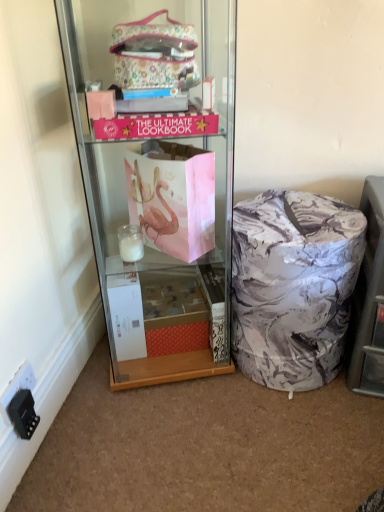
What do you see at coordinates (18, 384) in the screenshot?
I see `black plastic power outlet at lower left` at bounding box center [18, 384].

Describe the element at coordinates (293, 286) in the screenshot. I see `marble-patterned laundry basket at lower right` at that location.

This screenshot has height=512, width=384. What do you see at coordinates (159, 178) in the screenshot?
I see `matte pink paper bag at center` at bounding box center [159, 178].

Find the location of a particular element. The width and height of the screenshot is (384, 512). black plastic power outlet at lower left is located at coordinates (18, 384).

Does point (26, 380) lie in front of point (353, 336)?

Yes, point (26, 380) is closer to viewer.

Is black plastic power outlet at lower left positioned with its back to marble-patterned ottoman at lower right?

black plastic power outlet at lower left is not turned away from marble-patterned ottoman at lower right.

Is black plastic power outlet at lower left to the left or to the right of marble-patterned ottoman at lower right in the image?

black plastic power outlet at lower left is positioned on marble-patterned ottoman at lower right's left side.

Who is bigger, black plastic power outlet at lower left or marble-patterned ottoman at lower right?

marble-patterned ottoman at lower right.

Considering the relative sizes of marble-patterned laundry basket at lower right and marble-patterned ottoman at lower right in the image provided, is marble-patterned laundry basket at lower right bigger than marble-patterned ottoman at lower right?

Yes.

Is marble-patterned laundry basket at lower right touching marble-patterned ottoman at lower right?

No.

Is marble-patterned laundry basket at lower right outside of marble-patterned ottoman at lower right?

Yes, marble-patterned laundry basket at lower right is located beyond the bounds of marble-patterned ottoman at lower right.

Which object is wider, marble-patterned laundry basket at lower right or marble-patterned ottoman at lower right?

Wider between the two is marble-patterned ottoman at lower right.

In the scene shown: In terms of height, does black plastic power outlet at lower left look taller or shorter compared to marble-patterned laundry basket at lower right?

Considering their sizes, black plastic power outlet at lower left has less height than marble-patterned laundry basket at lower right.

Considering the relative sizes of black plastic power outlet at lower left and marble-patterned laundry basket at lower right in the image provided, is black plastic power outlet at lower left bigger than marble-patterned laundry basket at lower right?

No.

From the image's perspective, which object appears higher, black plastic power outlet at lower left or marble-patterned laundry basket at lower right?

marble-patterned laundry basket at lower right appears higher in the image.

Between black plastic power outlet at lower left and marble-patterned laundry basket at lower right, which one is positioned behind?

Positioned behind is marble-patterned laundry basket at lower right.

Relative to marble-patterned laundry basket at lower right, is marble-patterned ottoman at lower right in front or behind?

marble-patterned ottoman at lower right is positioned closer to the viewer than marble-patterned laundry basket at lower right.

Considering the relative sizes of marble-patterned ottoman at lower right and marble-patterned laundry basket at lower right in the image provided, is marble-patterned ottoman at lower right wider than marble-patterned laundry basket at lower right?

Yes, marble-patterned ottoman at lower right is wider than marble-patterned laundry basket at lower right.

Considering the positions of point (372, 237) and point (285, 234), is point (372, 237) closer or farther from the camera than point (285, 234)?

Point (372, 237) is positioned farther from the camera compared to point (285, 234).

From a real-world perspective, who is located higher, marble-patterned ottoman at lower right or marble-patterned laundry basket at lower right?

marble-patterned ottoman at lower right is physically above.

Is marble-patterned ottoman at lower right wider than matte pink paper bag at center?

No.

Is marble-patterned ottoman at lower right bigger than matte pink paper bag at center?

Actually, marble-patterned ottoman at lower right might be smaller than matte pink paper bag at center.

Is the surface of marble-patterned ottoman at lower right in direct contact with matte pink paper bag at center?

There is a gap between marble-patterned ottoman at lower right and matte pink paper bag at center.

Between matte pink paper bag at center and marble-patterned laundry basket at lower right, which one has smaller width?

Thinner between the two is marble-patterned laundry basket at lower right.

Is matte pink paper bag at center oriented away from marble-patterned laundry basket at lower right?

matte pink paper bag at center is not turned away from marble-patterned laundry basket at lower right.

Considering the sizes of objects matte pink paper bag at center and marble-patterned laundry basket at lower right in the image provided, who is bigger, matte pink paper bag at center or marble-patterned laundry basket at lower right?

Bigger between the two is matte pink paper bag at center.

Would you say matte pink paper bag at center is inside or outside marble-patterned laundry basket at lower right?

matte pink paper bag at center cannot be found inside marble-patterned laundry basket at lower right.

Who is bigger, marble-patterned laundry basket at lower right or black plastic power outlet at lower left?

marble-patterned laundry basket at lower right.

Is marble-patterned laundry basket at lower right spatially inside black plastic power outlet at lower left, or outside of it?

marble-patterned laundry basket at lower right cannot be found inside black plastic power outlet at lower left.

Who is more distant, marble-patterned laundry basket at lower right or black plastic power outlet at lower left?

marble-patterned laundry basket at lower right.

Identify the location of power outlet below the marble-patterned ottoman at lower right (from the image's perspective). (18, 384).

At what (x,y) coordinates should I click in order to perform the action: click on shelf in front of the marble-patterned laundry basket at lower right. Please return your answer as a coordinate pair (x, y). This screenshot has width=384, height=512. Looking at the image, I should click on point(369,300).

Looking at the image, which one is located further to marble-patterned laundry basket at lower right, matte pink paper bag at center or marble-patterned ottoman at lower right?

matte pink paper bag at center.

Considering their positions, is black plastic power outlet at lower left positioned further to marble-patterned laundry basket at lower right than matte pink paper bag at center?

Based on the image, black plastic power outlet at lower left appears to be further to marble-patterned laundry basket at lower right.

When comparing their distances from matte pink paper bag at center, does black plastic power outlet at lower left or marble-patterned ottoman at lower right seem further?

black plastic power outlet at lower left.

Based on their spatial positions, is marble-patterned ottoman at lower right or marble-patterned laundry basket at lower right further from black plastic power outlet at lower left?

marble-patterned ottoman at lower right is positioned further to the anchor black plastic power outlet at lower left.

Looking at the image, which one is located further to matte pink paper bag at center, marble-patterned ottoman at lower right or black plastic power outlet at lower left?

black plastic power outlet at lower left.

From the image, which object appears to be farther from black plastic power outlet at lower left, marble-patterned ottoman at lower right or matte pink paper bag at center?

marble-patterned ottoman at lower right is positioned further to the anchor black plastic power outlet at lower left.

When comparing their distances from marble-patterned laundry basket at lower right, does marble-patterned ottoman at lower right or black plastic power outlet at lower left seem closer?

Result: marble-patterned ottoman at lower right.

From the image, which object appears to be farther from matte pink paper bag at center, marble-patterned ottoman at lower right or marble-patterned laundry basket at lower right?

The object further to matte pink paper bag at center is marble-patterned ottoman at lower right.

Find the location of a particular element. Image resolution: width=384 pixels, height=512 pixels. material between matte pink paper bag at center and marble-patterned ottoman at lower right in the horizontal direction is located at coordinates (293, 286).

Locate an element on the screen. material between black plastic power outlet at lower left and marble-patterned ottoman at lower right from left to right is located at coordinates (293, 286).

The image size is (384, 512). Find the location of `cabinetry situated between black plastic power outlet at lower left and marble-patterned laundry basket at lower right from left to right`. cabinetry situated between black plastic power outlet at lower left and marble-patterned laundry basket at lower right from left to right is located at coordinates (159, 178).

Identify the location of cabinetry situated between black plastic power outlet at lower left and marble-patterned ottoman at lower right from left to right. (159, 178).